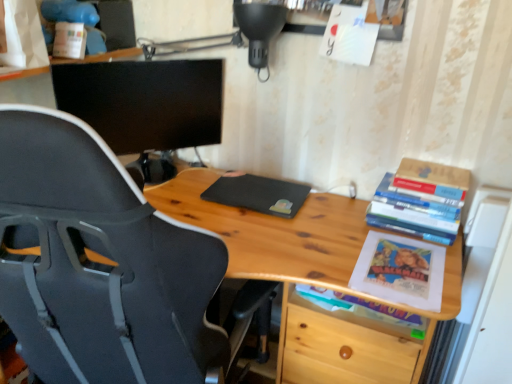
Question: Is black matte monitor at upper left aimed at wooden table at right?

Choices:
 (A) yes
 (B) no

Answer: (B)

Question: From the image's perspective, does black matte monitor at upper left appear higher than wooden table at right?

Choices:
 (A) no
 (B) yes

Answer: (B)

Question: From the image's perspective, would you say black matte monitor at upper left is shown under wooden table at right?

Choices:
 (A) no
 (B) yes

Answer: (A)

Question: Is wooden table at right a part of black matte monitor at upper left?

Choices:
 (A) yes
 (B) no

Answer: (B)

Question: Does black matte monitor at upper left have a larger size compared to wooden table at right?

Choices:
 (A) no
 (B) yes

Answer: (A)

Question: Is black matte monitor at upper left wider or thinner than hardcover books at right, which appears as the second book when ordered from the bottom?

Choices:
 (A) thin
 (B) wide

Answer: (A)

Question: Is black matte monitor at upper left taller or shorter than hardcover books at right, which appears as the 2th book when viewed from the top?

Choices:
 (A) short
 (B) tall

Answer: (B)

Question: In the image, is black matte monitor at upper left positioned in front of or behind hardcover books at right, which appears as the 2th book when viewed from the top?

Choices:
 (A) front
 (B) behind

Answer: (B)

Question: From the image's perspective, relative to hardcover books at right, which appears as the 2th book when viewed from the top, is black matte monitor at upper left above or below?

Choices:
 (A) below
 (B) above

Answer: (B)

Question: Looking at their shapes, would you say matte paper book at lower right, the third book viewed from the top, is wider or thinner than hardcover books at right, which appears as the second book when ordered from the bottom?

Choices:
 (A) wide
 (B) thin

Answer: (B)

Question: Is matte paper book at lower right, the third book viewed from the top, in front of or behind hardcover books at right, which appears as the second book when ordered from the bottom, in the image?

Choices:
 (A) front
 (B) behind

Answer: (A)

Question: From a real-world perspective, is matte paper book at lower right, the first book from the bottom, positioned above or below hardcover books at right, which appears as the second book when ordered from the bottom?

Choices:
 (A) below
 (B) above

Answer: (A)

Question: Is point (306, 286) positioned closer to the camera than point (437, 205)?

Choices:
 (A) closer
 (B) farther

Answer: (B)

Question: Is hardcover books at right, which appears as the second book when ordered from the bottom, in front of or behind black matte monitor at upper left in the image?

Choices:
 (A) behind
 (B) front

Answer: (B)

Question: Is hardcover books at right, which appears as the second book when ordered from the bottom, wider or thinner than black matte monitor at upper left?

Choices:
 (A) thin
 (B) wide

Answer: (B)